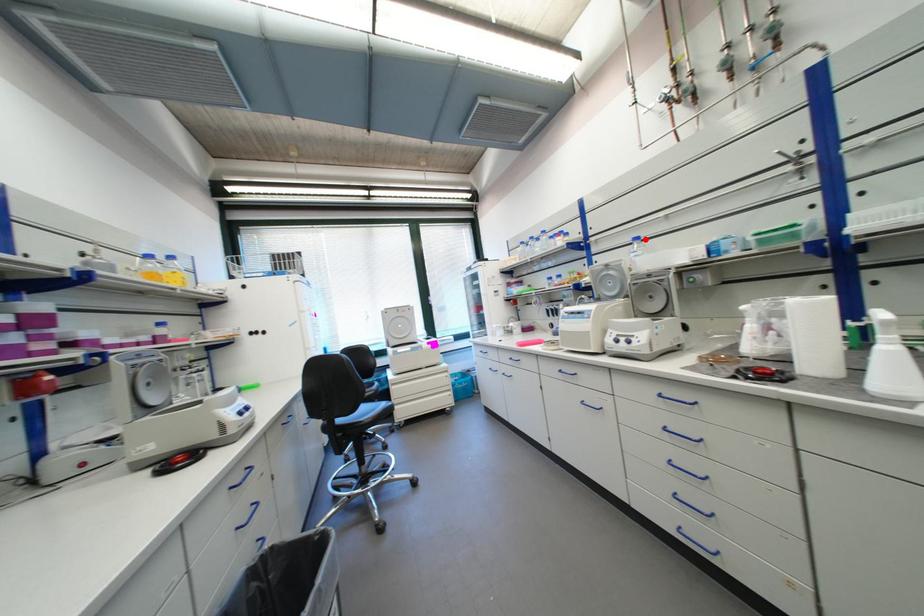
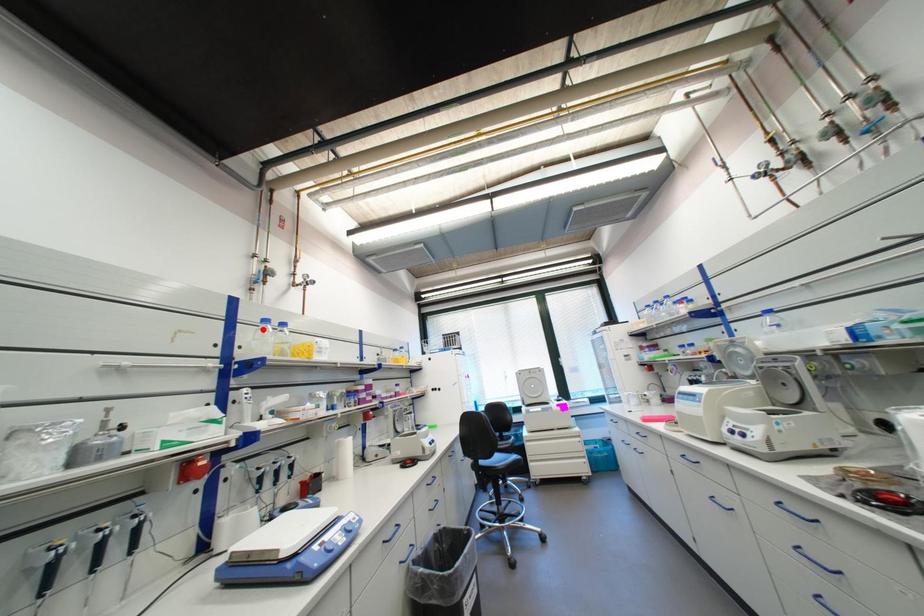
From the picture: I am providing you with two images of the same scene from different viewpoints. A red point is marked on the first image and another point is marked on the second image. Are the points marked in image1 and image2 representing the same 3D position?

No